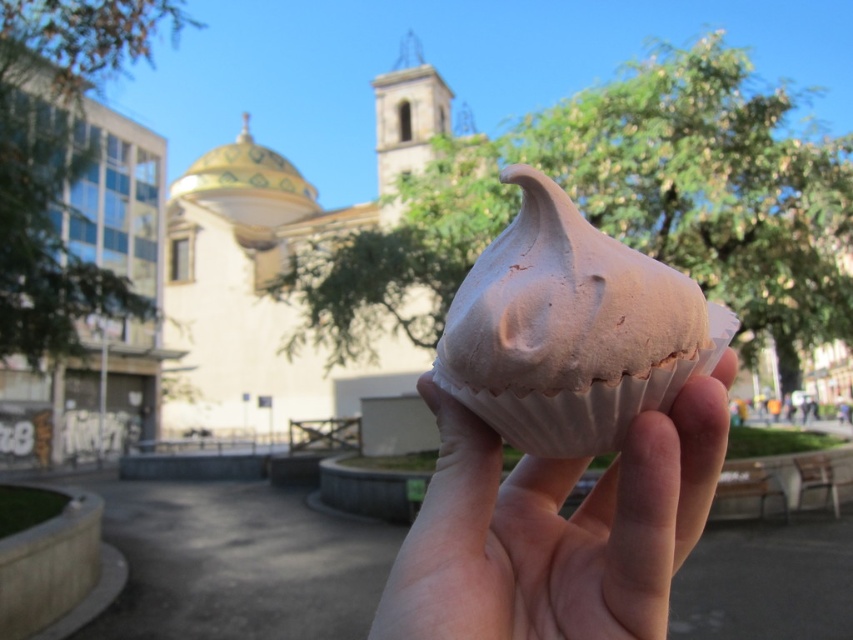
Between point (235, 330) and point (604, 371), which one is positioned in front?

Point (604, 371)

Can you confirm if beige stone church at center is shorter than chocolate matte muffin at center?

Incorrect, beige stone church at center's height does not fall short of chocolate matte muffin at center's.

You are a GUI agent. You are given a task and a screenshot of the screen. Output one action in this format:
    pyautogui.click(x=<x>, y=<y>)
    Task: Click on the beige stone church at center
    
    Given the screenshot: What is the action you would take?
    pyautogui.click(x=288, y=276)

Where is `beige stone church at center`? The height and width of the screenshot is (640, 853). beige stone church at center is located at coordinates (288, 276).

Who is shorter, white paper cupcake at center or chocolate matte muffin at center?

With less height is white paper cupcake at center.

Does white paper cupcake at center have a lesser width compared to chocolate matte muffin at center?

No.

Where is `white paper cupcake at center`? This screenshot has height=640, width=853. white paper cupcake at center is located at coordinates (556, 529).

The width and height of the screenshot is (853, 640). Find the location of `white paper cupcake at center`. white paper cupcake at center is located at coordinates (556, 529).

Does beige stone church at center appear over white paper cupcake at center?

Correct, beige stone church at center is located above white paper cupcake at center.

Is beige stone church at center to the left of white paper cupcake at center from the viewer's perspective?

Correct, you'll find beige stone church at center to the left of white paper cupcake at center.

Find the location of a particular element. The image size is (853, 640). beige stone church at center is located at coordinates (288, 276).